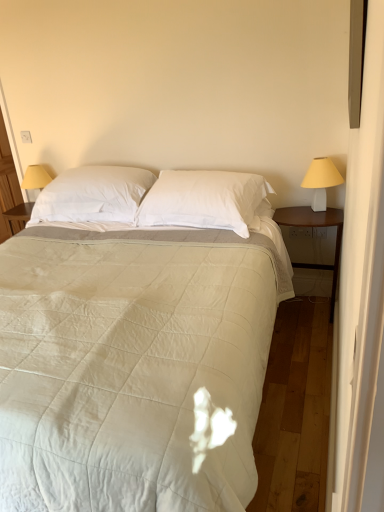
Question: Considering the positions of point (296, 219) and point (147, 169), is point (296, 219) closer or farther from the camera than point (147, 169)?

Choices:
 (A) farther
 (B) closer

Answer: (B)

Question: From a real-world perspective, is wooden nightstand at right positioned above or below white soft pillow at center, marked as the 1th pillow in a left-to-right arrangement?

Choices:
 (A) above
 (B) below

Answer: (B)

Question: Estimate the real-world distances between objects in this image. Which object is farther from the wooden nightstand at right?

Choices:
 (A) white quilted fabric bed at center
 (B) yellow fabric lampshade at left
 (C) white soft pillow at center, marked as the 1th pillow in a left-to-right arrangement
 (D) white plastic lampshade at right
 (E) matte wooden screen door at left

Answer: (E)

Question: Estimate the real-world distances between objects in this image. Which object is closer to the matte wooden screen door at left?

Choices:
 (A) white plastic lampshade at right
 (B) wooden nightstand at right
 (C) white soft pillow at center, which is the 2th pillow in right-to-left order
 (D) white quilted fabric bed at center
 (E) white cotton pillow at center, which is counted as the first pillow, starting from the right

Answer: (C)